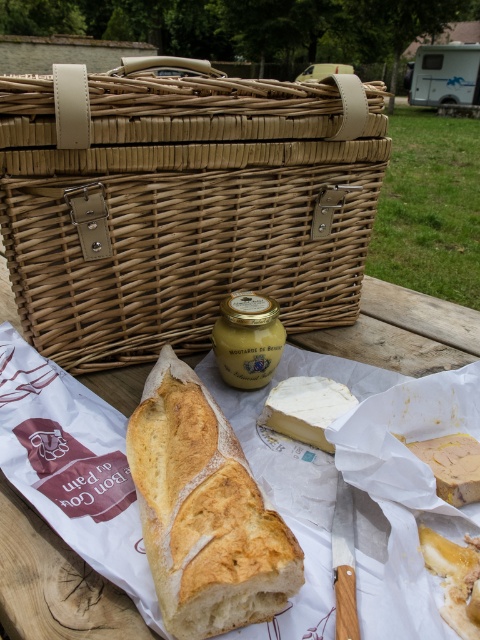
Image resolution: width=480 pixels, height=640 pixels. Describe the element at coordinates (186, 205) in the screenshot. I see `woven wood picnic basket at upper center` at that location.

The image size is (480, 640). What do you see at coordinates (186, 205) in the screenshot? I see `woven wood picnic basket at upper center` at bounding box center [186, 205].

This screenshot has height=640, width=480. I want to click on woven wood picnic basket at upper center, so click(186, 205).

Describe the element at coordinates (204, 512) in the screenshot. The width and height of the screenshot is (480, 640). I see `golden brown crusty loaf of bread at center` at that location.

Does golden brown crusty loaf of bread at center have a lesser height compared to white creamy cheese at center?

No, golden brown crusty loaf of bread at center is not shorter than white creamy cheese at center.

Is point (240, 609) in front of point (282, 410)?

Yes, point (240, 609) is closer to viewer.

This screenshot has width=480, height=640. Find the location of `golden brown crusty loaf of bread at center`. golden brown crusty loaf of bread at center is located at coordinates (204, 512).

Can you confirm if woven wood picnic basket at upper center is shorter than white creamy cheese at center?

No.

Who is lower down, woven wood picnic basket at upper center or white creamy cheese at center?

white creamy cheese at center

Where is `woven wood picnic basket at upper center`? Image resolution: width=480 pixels, height=640 pixels. woven wood picnic basket at upper center is located at coordinates (186, 205).